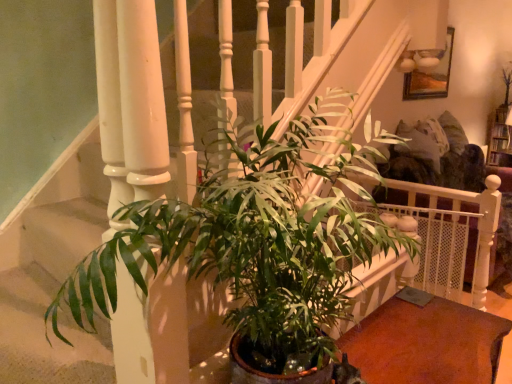
What do you see at coordinates (256, 243) in the screenshot? I see `green glossy plant at center` at bounding box center [256, 243].

Where is `green glossy plant at center`? This screenshot has height=384, width=512. green glossy plant at center is located at coordinates (256, 243).

Measure the distance between green glossy plant at center and camera.

green glossy plant at center and camera are 24.55 inches apart.

This screenshot has height=384, width=512. Describe the element at coordinates (426, 342) in the screenshot. I see `smooth brown table at lower right` at that location.

Image resolution: width=512 pixels, height=384 pixels. In order to click on smooth brown table at lower right in this screenshot , I will do `click(426, 342)`.

Consider the image. Measure the distance between smooth brown table at lower right and camera.

They are 1.09 meters apart.

Where is `green glossy plant at center`? This screenshot has height=384, width=512. green glossy plant at center is located at coordinates (256, 243).

Which is more to the right, green glossy plant at center or smooth brown table at lower right?

Positioned to the right is smooth brown table at lower right.

Is green glossy plant at center closer to the viewer compared to smooth brown table at lower right?

Yes, it is in front of smooth brown table at lower right.

Is point (245, 161) closer to camera compared to point (391, 305)?

Yes.

From the image's perspective, which one is positioned higher, green glossy plant at center or smooth brown table at lower right?

green glossy plant at center, from the image's perspective.

From a real-world perspective, which is physically above, green glossy plant at center or smooth brown table at lower right?

green glossy plant at center, from a real-world perspective.

Which of these two, green glossy plant at center or smooth brown table at lower right, is thinner?

smooth brown table at lower right.

Considering the sizes of objects green glossy plant at center and smooth brown table at lower right in the image provided, who is shorter, green glossy plant at center or smooth brown table at lower right?

smooth brown table at lower right.

Based on their sizes in the image, would you say green glossy plant at center is bigger or smaller than smooth brown table at lower right?

Considering their sizes, green glossy plant at center takes up more space than smooth brown table at lower right.

Is green glossy plant at center not within smooth brown table at lower right?

Yes, green glossy plant at center is not within smooth brown table at lower right.

Is green glossy plant at center not close to smooth brown table at lower right?

They are positioned close to each other.

Is green glossy plant at center oriented towards smooth brown table at lower right?

No.

The width and height of the screenshot is (512, 384). In order to click on houseplant on the left side of smooth brown table at lower right in this screenshot , I will do `click(256, 243)`.

Based on their positions, is smooth brown table at lower right located to the left or right of green glossy plant at center?

Based on their positions, smooth brown table at lower right is located to the right of green glossy plant at center.

Is the position of smooth brown table at lower right more distant than that of green glossy plant at center?

That is True.

Is point (451, 309) positioned in front of point (310, 364)?

No, it is behind (310, 364).

From the image's perspective, which one is positioned higher, smooth brown table at lower right or green glossy plant at center?

green glossy plant at center appears higher in the image.

From a real-world perspective, is smooth brown table at lower right physically located above or below green glossy plant at center?

Clearly, from a real-world perspective, smooth brown table at lower right is below green glossy plant at center.

Between smooth brown table at lower right and green glossy plant at center, which one has larger width?

green glossy plant at center.

Considering the sizes of smooth brown table at lower right and green glossy plant at center in the image, is smooth brown table at lower right taller or shorter than green glossy plant at center?

Clearly, smooth brown table at lower right is shorter compared to green glossy plant at center.

Considering the relative sizes of smooth brown table at lower right and green glossy plant at center in the image provided, is smooth brown table at lower right bigger than green glossy plant at center?

Actually, smooth brown table at lower right might be smaller than green glossy plant at center.

Is smooth brown table at lower right located outside green glossy plant at center?

Yes, smooth brown table at lower right is located beyond the bounds of green glossy plant at center.

Is the surface of smooth brown table at lower right in direct contact with green glossy plant at center?

No, smooth brown table at lower right is not touching green glossy plant at center.

Is smooth brown table at lower right oriented away from green glossy plant at center?

smooth brown table at lower right does not have its back to green glossy plant at center.

How different are the orientations of smooth brown table at lower right and green glossy plant at center in degrees?

The facing directions of smooth brown table at lower right and green glossy plant at center are 1.34 degrees apart.

Where is `table below the green glossy plant at center (from the image's perspective)`? The height and width of the screenshot is (384, 512). table below the green glossy plant at center (from the image's perspective) is located at coordinates (426, 342).

In the image, there is a smooth brown table at lower right. Identify the location of houseplant above it (from the image's perspective). (256, 243).

I want to click on table that appears on the right of green glossy plant at center, so click(426, 342).